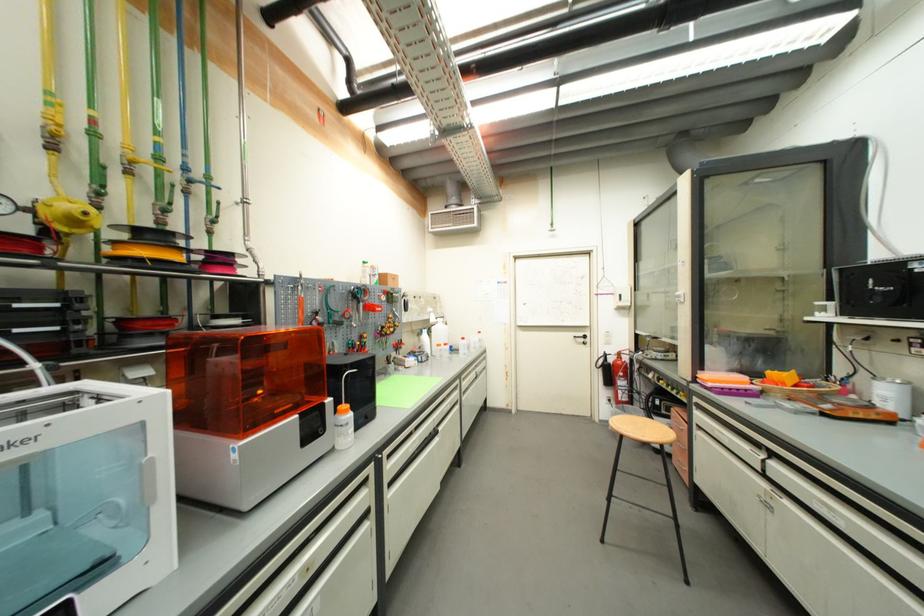
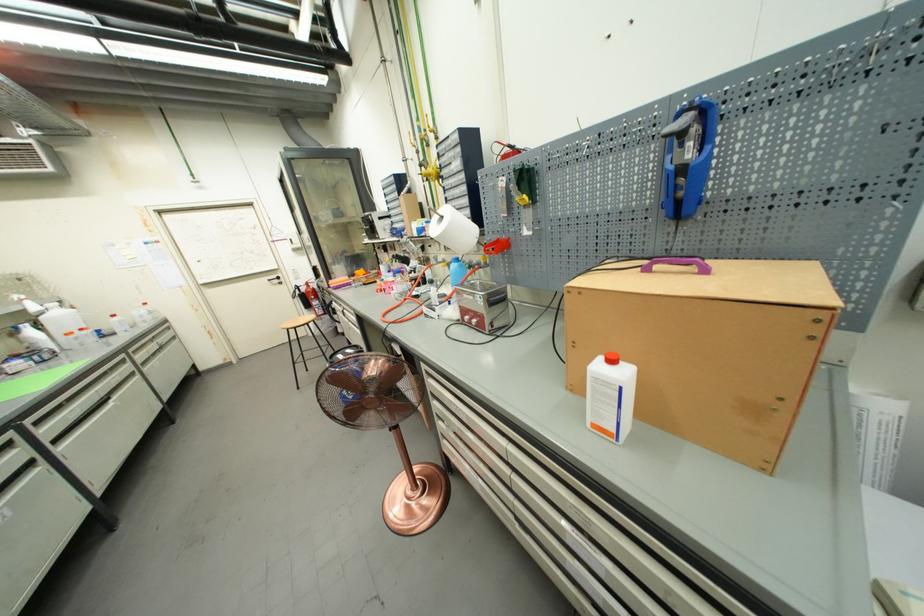
Where in the second image is the point corresponding to the point at 468,392 from the first image?

(146, 363)